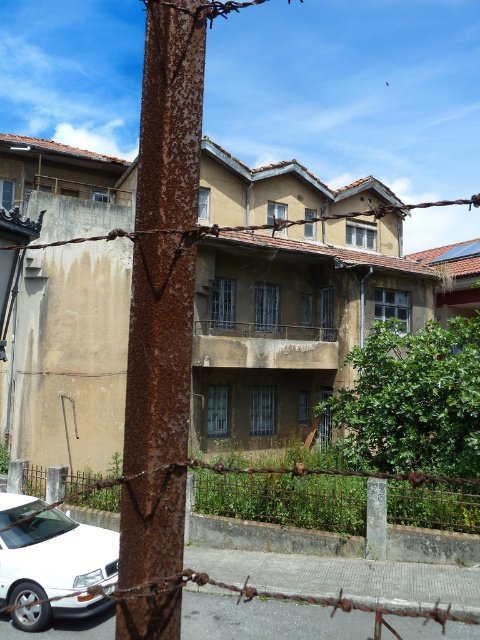
Who is more distant from viewer, (x=240, y=502) or (x=376, y=208)?

Positioned behind is point (x=376, y=208).

Does point (199, 493) come closer to viewer compared to point (203, 230)?

No, it is not.

Is point (212, 502) more distant than point (20, 243)?

Yes.

At what (x,y) coordinates should I click in order to perform the action: click on rusty metal fence at center. Please return your answer as a coordinate pair (x, y). This screenshot has width=480, height=640. Looking at the image, I should click on (285, 499).

Which is more to the left, white matte car at lower left or rusty wire at upper center?

Positioned to the left is white matte car at lower left.

Is point (115, 586) farther from viewer compared to point (151, 230)?

Yes.

Does point (52, 552) come farther from viewer compared to point (208, 227)?

Yes, point (52, 552) is behind point (208, 227).

You are a GUI agent. You are given a task and a screenshot of the screen. Output one action in this format:
    pyautogui.click(x=<x>, y=<y>)
    Task: Click on the white matte car at lower left
    Image resolution: width=480 pixels, height=640 pixels.
    Given the screenshot: What is the action you would take?
    pyautogui.click(x=56, y=568)

Is rusty metal fence at center bigger than white matte car at lower left?

No, rusty metal fence at center is not bigger than white matte car at lower left.

Which of these two, rusty metal fence at center or white matte car at lower left, stands shorter?

rusty metal fence at center

Does point (276, 499) lie behind point (66, 540)?

Yes, it is.

What are the coordinates of `rusty metal fence at center` in the screenshot? It's located at (285, 499).